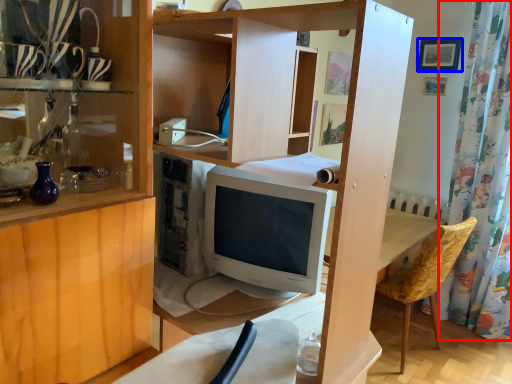
Question: Which of the following is the farthest to the observer, shower curtain (highlighted by a red box) or picture frame (highlighted by a blue box)?

Choices:
 (A) shower curtain
 (B) picture frame

Answer: (B)